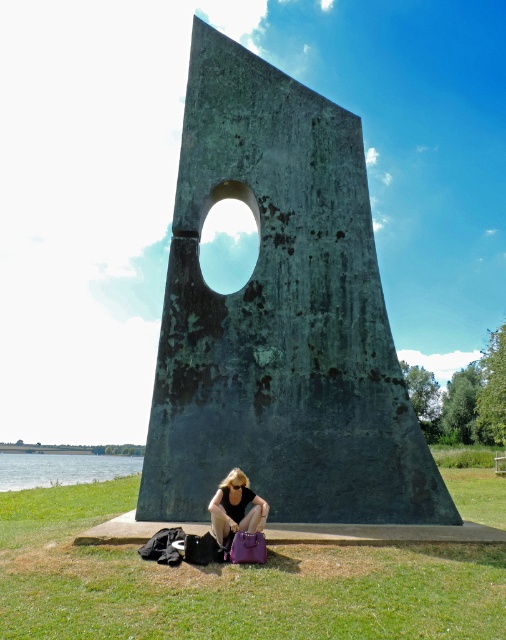
Question: Which object appears closest to the camera in this image?

Choices:
 (A) matte purple handbag at lower center
 (B) green water at lower left
 (C) green grass at lower center

Answer: (C)

Question: Where is green water at lower left located in relation to matte purple handbag at lower center in the image?

Choices:
 (A) left
 (B) right

Answer: (A)

Question: Does green water at lower left appear on the left side of matte purple handbag at lower center?

Choices:
 (A) yes
 (B) no

Answer: (A)

Question: Which of the following is the farthest from the observer?

Choices:
 (A) green grass at lower center
 (B) green patina stone sculpture at center
 (C) green water at lower left

Answer: (C)

Question: Does green patina stone sculpture at center have a smaller size compared to matte purple handbag at lower center?

Choices:
 (A) yes
 (B) no

Answer: (A)

Question: Which of the following is the farthest from the observer?

Choices:
 (A) (210, 515)
 (B) (28, 476)
 (C) (421, 566)
 (D) (285, 296)

Answer: (B)